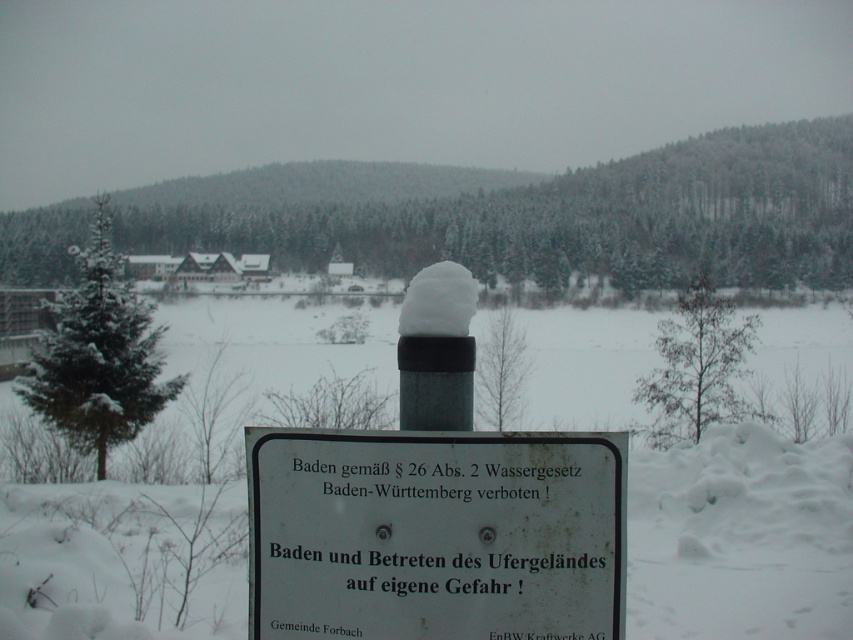
Question: Which point is closer to the camera?

Choices:
 (A) white fluffy snow at center
 (B) white plastic sign at center

Answer: (B)

Question: Can you confirm if white plastic sign at center is smaller than white fluffy snow at center?

Choices:
 (A) yes
 (B) no

Answer: (B)

Question: In this image, where is white plastic sign at center located relative to white fluffy snow at center?

Choices:
 (A) above
 (B) below

Answer: (B)

Question: Which object appears closest to the camera in this image?

Choices:
 (A) white fluffy snow at center
 (B) white plastic sign at center

Answer: (B)

Question: Does white plastic sign at center have a lesser width compared to white fluffy snow at center?

Choices:
 (A) no
 (B) yes

Answer: (A)